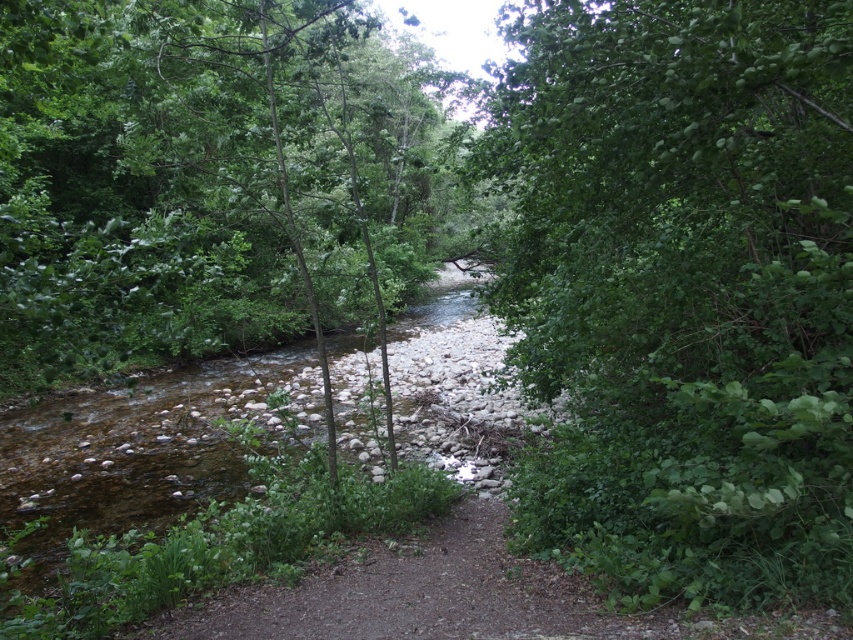
You are planning to place a small wooden bench between the green leafy tree at right and the green leafy tree at center. The bench is 1.5 meters long. Will there be enough space between them to fit the bench?

The green leafy tree at right and green leafy tree at center are 3.87 meters apart, so yes, the bench will fit since the distance between them is greater than the bench length of 1.5 meters.

You are standing in the middle of the stream and want to reach the green leafy tree at right and the green leafy tree at center. Which tree is closer to your current position?

The green leafy tree at center is closer because it is positioned to the left of the green leafy tree at right, so you would reach it first while moving towards the right side.

You are standing at the edge of the stream and want to walk to the green leafy tree at center. There is a green leafy tree at right nearby. Which tree is closer to your current position?

The green leafy tree at right is closer to your current position because it is smaller in size compared to the green leafy tree at center, which is larger and farther away.